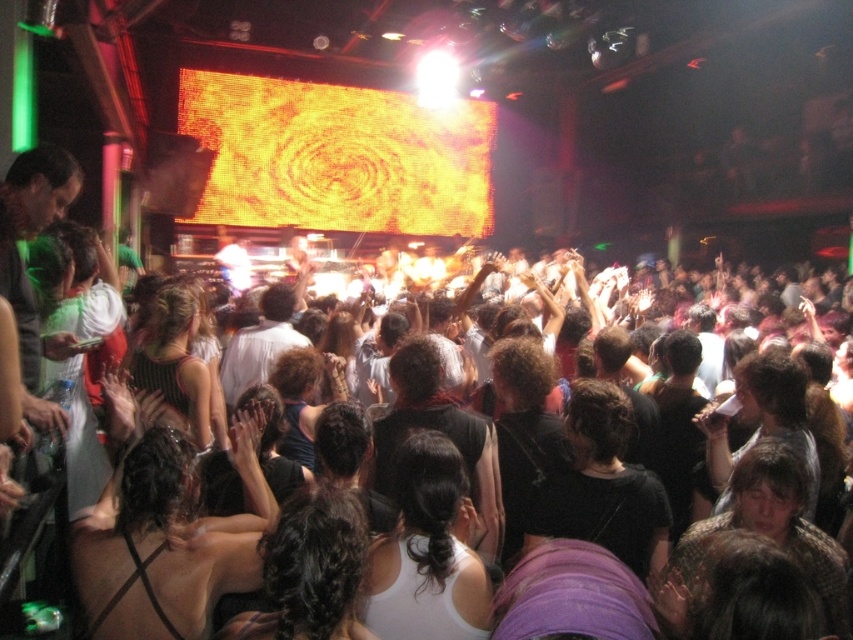
You are a photographer trying to capture the crowd in the nightclub. You notice two points in the image at coordinates point (699,561) and point (485,531). Which point is closer to your camera lens?

Point (699,561) is closer to the camera than point (485,531).